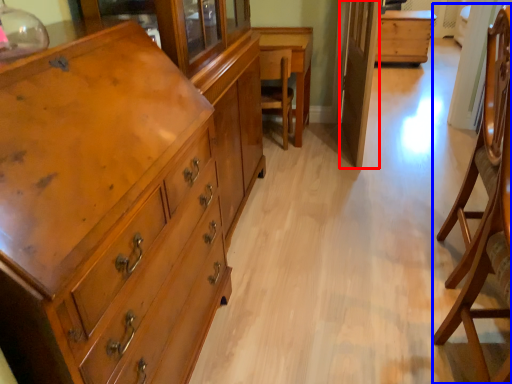
Question: Among these objects, which one is farthest to the camera, glass door (highlighted by a red box) or armchair (highlighted by a blue box)?

Choices:
 (A) glass door
 (B) armchair

Answer: (A)